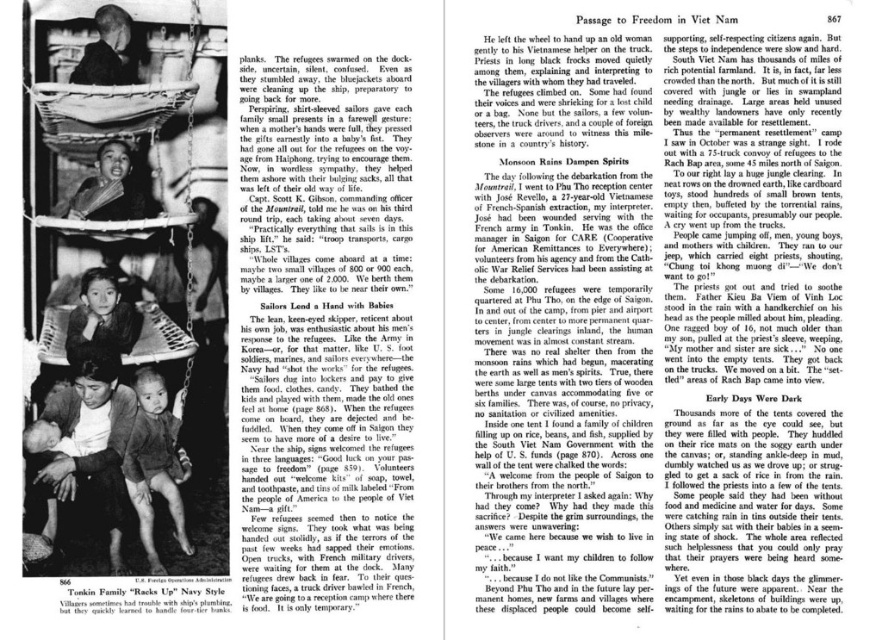
What color is the skin of the person at point [155,464] on the left page?

The skin at point [155,464] is light brown.

What is the 2D coordinate of the matte black laptop at center?

The matte black laptop at center is located at the 2D coordinate point of (325, 332).